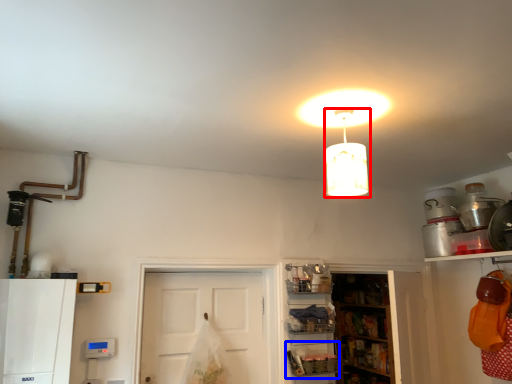
Question: Among these objects, which one is nearest to the camera, lamp (highlighted by a red box) or shelf (highlighted by a blue box)?

Choices:
 (A) lamp
 (B) shelf

Answer: (A)